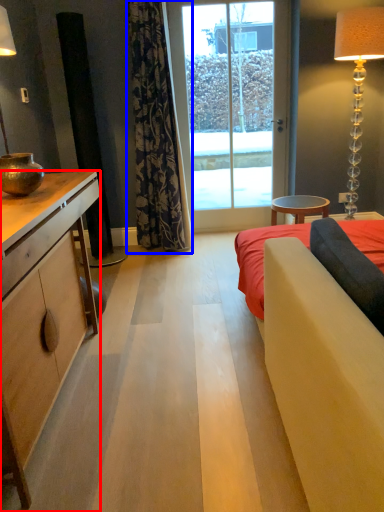
Question: Which object is further to the camera taking this photo, cabinetry (highlighted by a red box) or curtain (highlighted by a blue box)?

Choices:
 (A) cabinetry
 (B) curtain

Answer: (B)